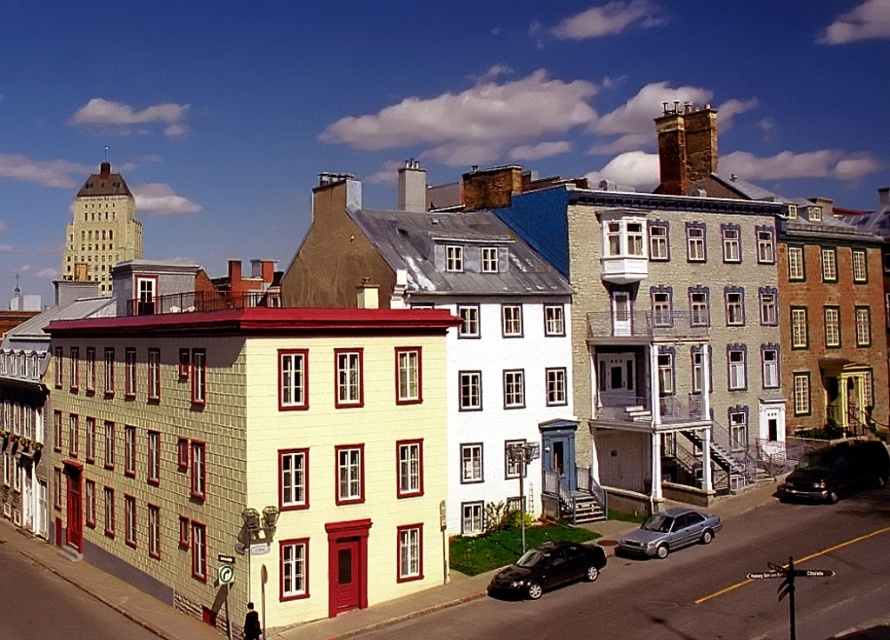
Who is taller, shiny black van at lower right or metallic silver sedan at center?

shiny black van at lower right

Looking at this image, is shiny black van at lower right to the right of metallic silver sedan at center from the viewer's perspective?

Indeed, shiny black van at lower right is positioned on the right side of metallic silver sedan at center.

Does point (848, 444) come behind point (654, 536)?

Yes, it is behind point (654, 536).

Where is `shiny black van at lower right`? This screenshot has width=890, height=640. shiny black van at lower right is located at coordinates (836, 472).

The width and height of the screenshot is (890, 640). I want to click on shiny black van at lower right, so click(x=836, y=472).

Is point (808, 467) farther from viewer compared to point (518, 561)?

Yes.

I want to click on shiny black van at lower right, so click(836, 472).

Looking at this image, can you confirm if shiny black sedan at lower center is positioned above metallic silver sedan at center?

No.

Is shiny black sedan at lower center smaller than metallic silver sedan at center?

Actually, shiny black sedan at lower center might be larger than metallic silver sedan at center.

Is point (495, 595) less distant than point (676, 547)?

That is True.

You are a GUI agent. You are given a task and a screenshot of the screen. Output one action in this format:
    pyautogui.click(x=<x>, y=<y>)
    Task: Click on the shiny black sedan at lower center
    The height and width of the screenshot is (640, 890).
    Given the screenshot: What is the action you would take?
    tap(547, 568)